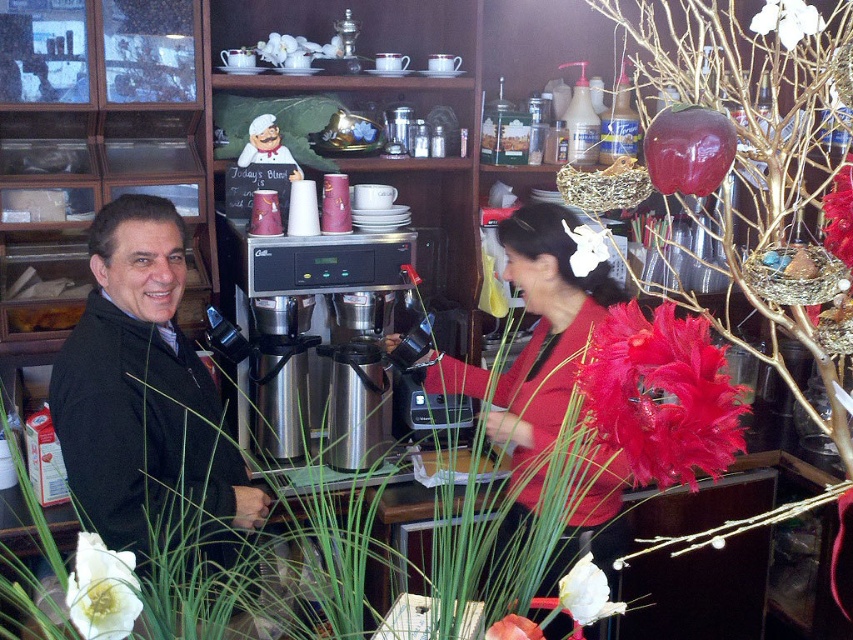
Does white matte flower at lower left have a larger size compared to white matte flower at upper right?

No.

Identify the location of white matte flower at lower left. The image size is (853, 640). (102, 589).

The width and height of the screenshot is (853, 640). What are the coordinates of `white matte flower at lower left` in the screenshot? It's located at (102, 589).

Who is taller, matte black jacket at left or white matte flower at lower center?

Standing taller between the two is matte black jacket at left.

Can you confirm if matte black jacket at left is positioned below white matte flower at lower center?

No, matte black jacket at left is not below white matte flower at lower center.

Which is behind, point (514, 436) or point (567, 589)?

Point (514, 436)

I want to click on matte black jacket at left, so click(544, 326).

The width and height of the screenshot is (853, 640). Describe the element at coordinates (146, 401) in the screenshot. I see `black matte jacket at left` at that location.

In the scene shown: Does black matte jacket at left have a lesser height compared to stainless steel coffee machine at center?

No, black matte jacket at left is not shorter than stainless steel coffee machine at center.

Does point (238, 525) come behind point (320, 368)?

No, it is in front of (320, 368).

Find the location of a particular element. The image size is (853, 640). black matte jacket at left is located at coordinates (146, 401).